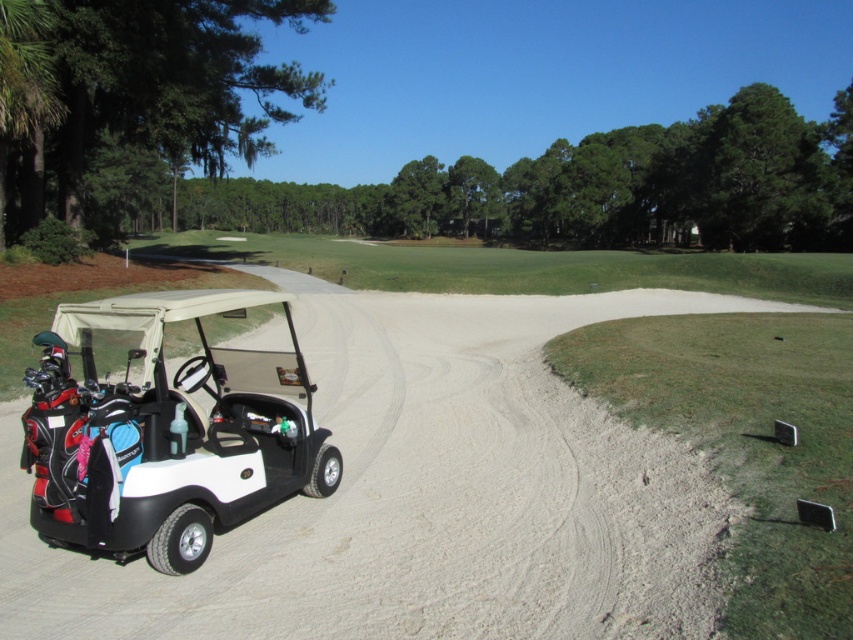
You are a golfer standing at the starting point of the course. You need to reach the green area in the background. Based on the image, is the white matte golf cart at lower left positioned closer to the sandy path or the grassy area?

The white matte golf cart at lower left is located at point (440, 461), which places it closer to the sandy path rather than the grassy area in the background.

You are a golfer standing at the starting point of the course. You see a white matte golf cart at lower left and a white matte golf cart at left. Which one is closer to you?

The white matte golf cart at lower left is closer to you since it is positioned lower in the scene, indicating it is nearer to the observer.